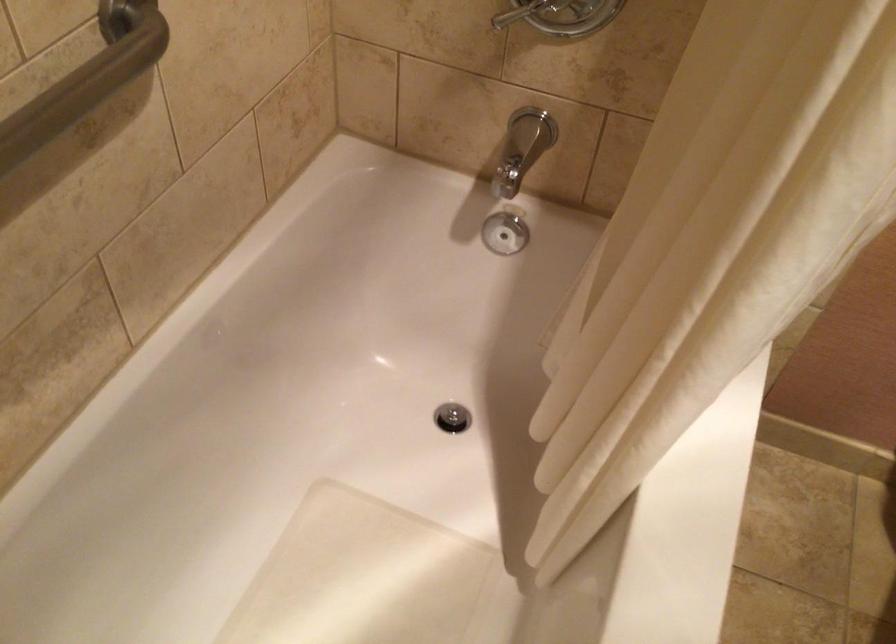
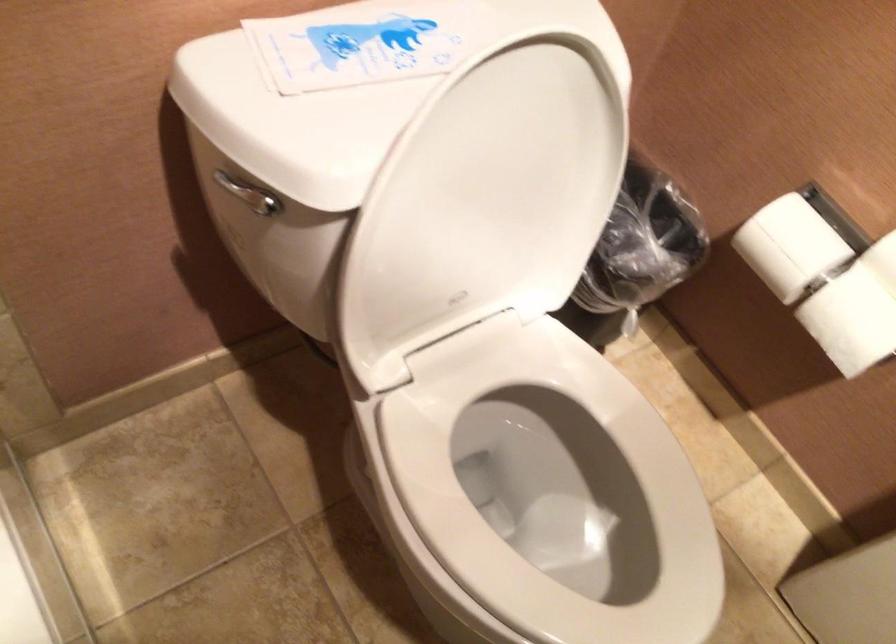
First-person continuous shooting, in which direction is the camera rotating?

The camera rotated toward right-down.